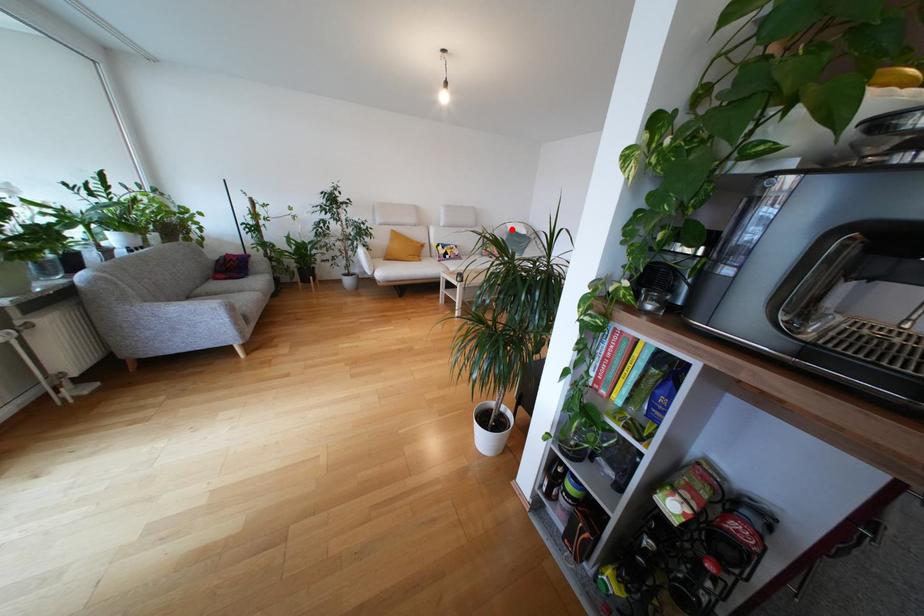
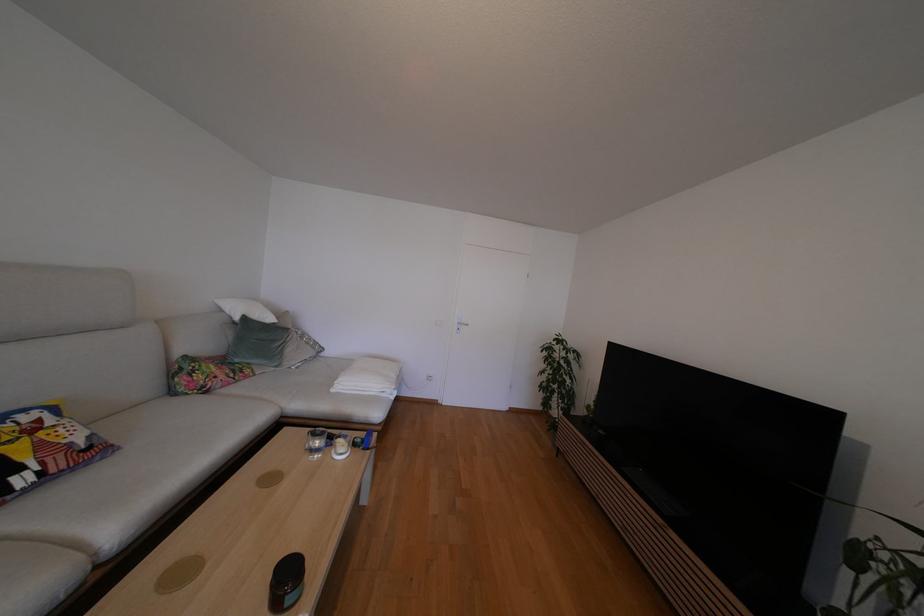
Question: I am providing you with two images of the same scene from different viewpoints. Given a red point in image1, look at the same physical point in image2. Is it:

Choices:
 (A) Closer to the viewpoint
 (B) Farther from the viewpoint

Answer: (A)